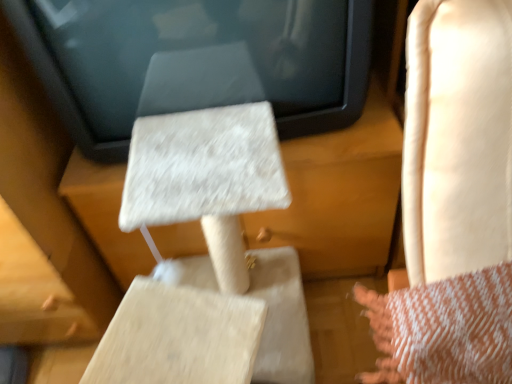
Question: Considering the relative sizes of light beige leather rocking chair at right and white textured cat tree at center in the image provided, is light beige leather rocking chair at right bigger than white textured cat tree at center?

Choices:
 (A) yes
 (B) no

Answer: (B)

Question: From a real-world perspective, is light beige leather rocking chair at right over white textured cat tree at center?

Choices:
 (A) no
 (B) yes

Answer: (A)

Question: Is light beige leather rocking chair at right closer to camera compared to white textured cat tree at center?

Choices:
 (A) yes
 (B) no

Answer: (A)

Question: Is light beige leather rocking chair at right at the right side of white textured cat tree at center?

Choices:
 (A) yes
 (B) no

Answer: (A)

Question: Is light beige leather rocking chair at right oriented towards white textured cat tree at center?

Choices:
 (A) no
 (B) yes

Answer: (A)

Question: Is light beige leather rocking chair at right turned away from white textured cat tree at center?

Choices:
 (A) yes
 (B) no

Answer: (B)

Question: Is white textured cat tree at center not near light beige leather rocking chair at right?

Choices:
 (A) no
 (B) yes

Answer: (A)

Question: Can you confirm if white textured cat tree at center is thinner than light beige leather rocking chair at right?

Choices:
 (A) no
 (B) yes

Answer: (A)

Question: From a real-world perspective, is white textured cat tree at center under light beige leather rocking chair at right?

Choices:
 (A) no
 (B) yes

Answer: (A)

Question: From the image's perspective, would you say white textured cat tree at center is positioned over light beige leather rocking chair at right?

Choices:
 (A) yes
 (B) no

Answer: (A)

Question: Can you confirm if white textured cat tree at center is bigger than light beige leather rocking chair at right?

Choices:
 (A) yes
 (B) no

Answer: (A)

Question: Does white textured cat tree at center lie in front of light beige leather rocking chair at right?

Choices:
 (A) yes
 (B) no

Answer: (B)

Question: Is light beige leather rocking chair at right far away from beige textured cat tree at center?

Choices:
 (A) no
 (B) yes

Answer: (A)